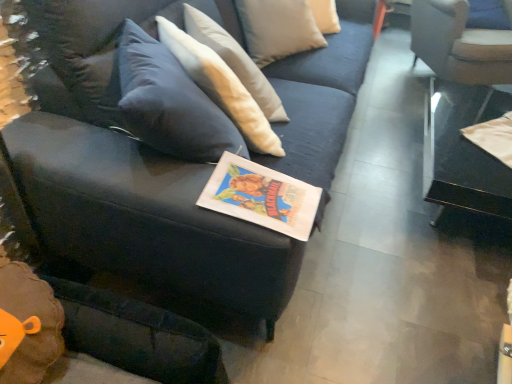
Question: Would you say transparent glass table at right is a long distance from matte paper book at center?

Choices:
 (A) no
 (B) yes

Answer: (B)

Question: Can you confirm if transparent glass table at right is positioned to the left of matte paper book at center?

Choices:
 (A) yes
 (B) no

Answer: (B)

Question: Is transparent glass table at right beside matte paper book at center?

Choices:
 (A) yes
 (B) no

Answer: (B)

Question: Can you confirm if transparent glass table at right is thinner than matte paper book at center?

Choices:
 (A) no
 (B) yes

Answer: (A)

Question: From a real-world perspective, is transparent glass table at right over matte paper book at center?

Choices:
 (A) yes
 (B) no

Answer: (B)

Question: In the image, is matte paper book at center on the left side or the right side of white fabric chair at upper right?

Choices:
 (A) left
 (B) right

Answer: (A)

Question: Is matte paper book at center inside or outside of white fabric chair at upper right?

Choices:
 (A) inside
 (B) outside

Answer: (B)

Question: Based on their sizes in the image, would you say matte paper book at center is bigger or smaller than white fabric chair at upper right?

Choices:
 (A) small
 (B) big

Answer: (A)

Question: From a real-world perspective, is matte paper book at center above or below white fabric chair at upper right?

Choices:
 (A) above
 (B) below

Answer: (A)

Question: Considering the positions of point (481, 61) and point (487, 192), is point (481, 61) closer or farther from the camera than point (487, 192)?

Choices:
 (A) closer
 (B) farther

Answer: (B)

Question: In the image, is white fabric chair at upper right on the left side or the right side of transparent glass table at right?

Choices:
 (A) right
 (B) left

Answer: (A)

Question: From the image's perspective, is white fabric chair at upper right positioned above or below transparent glass table at right?

Choices:
 (A) below
 (B) above

Answer: (B)

Question: Would you say white fabric chair at upper right is inside or outside transparent glass table at right?

Choices:
 (A) outside
 (B) inside

Answer: (A)

Question: Considering their positions, is velvet dark blue couch at center located in front of or behind white fabric chair at upper right?

Choices:
 (A) front
 (B) behind

Answer: (A)

Question: From the image's perspective, is velvet dark blue couch at center positioned above or below white fabric chair at upper right?

Choices:
 (A) above
 (B) below

Answer: (B)